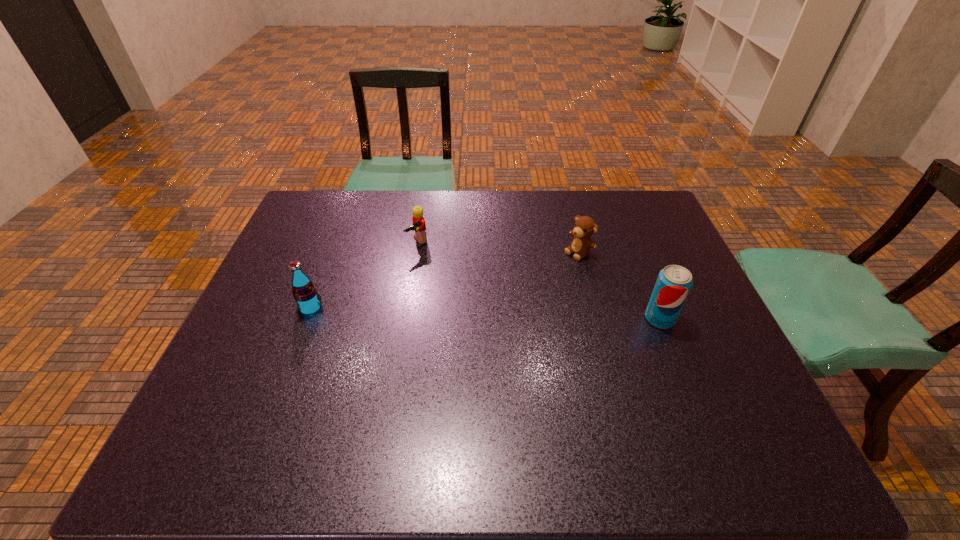
Identify the location of vacant space on the desktop that is between the left soda can and the rightmost object and is positioned on the face of the teddy bear. Image resolution: width=960 pixels, height=540 pixels. (483, 314).

The width and height of the screenshot is (960, 540). Identify the location of free space on the desktop that is between the leftmost object and the right soda can and is positioned in front of the second object from left to right with the accessory visible. point(487,314).